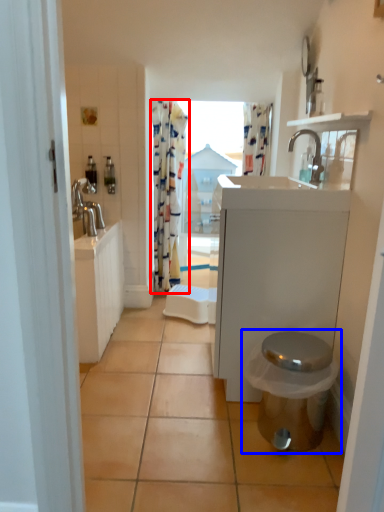
Question: Which of the following is the closest to the observer, curtain (highlighted by a red box) or toilet (highlighted by a blue box)?

Choices:
 (A) curtain
 (B) toilet

Answer: (B)